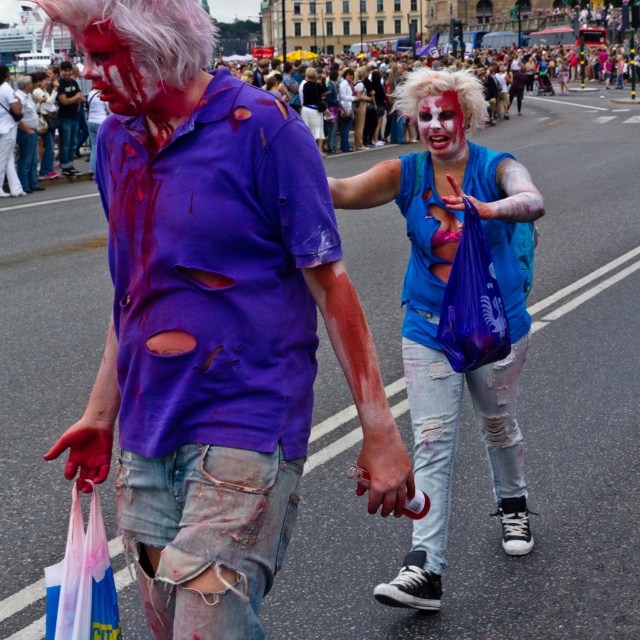
You are a photographer at the zombie walk event. You want to take a closeup shot of the matte purple shirt at center. Where should you point your camera?

You should point your camera at point [216,328] to capture the matte purple shirt at center.

You are a photographer trying to capture a clear photo of the matte purple shirt at center and the ripped denim shorts at center. Since you can only focus on one object at a time, which one should you choose to ensure the other is still somewhat in focus?

You should focus on the matte purple shirt at center because it is closer to the viewer. By focusing on the closer object, the depth of field may still keep the ripped denim shorts at center somewhat in focus.

You are a photographer trying to capture both the blue ripped jeans at center and the matte white face at upper left in a single shot. Considering their sizes in the frame, which object should you focus on first to ensure both are in focus?

The blue ripped jeans at center is much taller than the matte white face at upper left, so focusing on the larger object first will help ensure both are in focus.